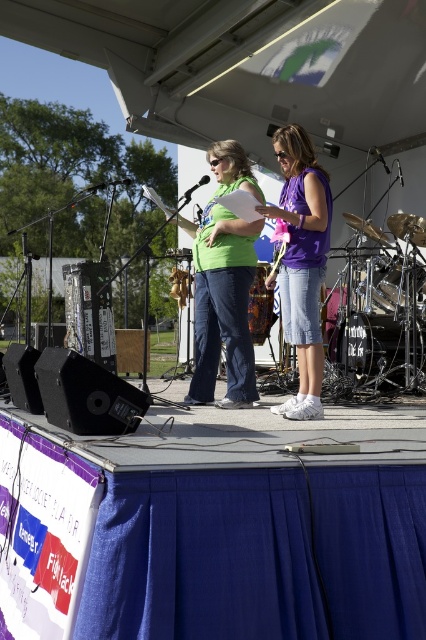
Consider the image. You are a stagehand responsible for arranging chairs between the matte green shirt at center and the purple cotton shirt at center. If each chair requires 50 centimeters of space, can you fit one chair between them?

The distance between the matte green shirt at center and the purple cotton shirt at center is 43.49 centimeters. Since each chair needs 50 centimeters, you cannot fit one chair between them.